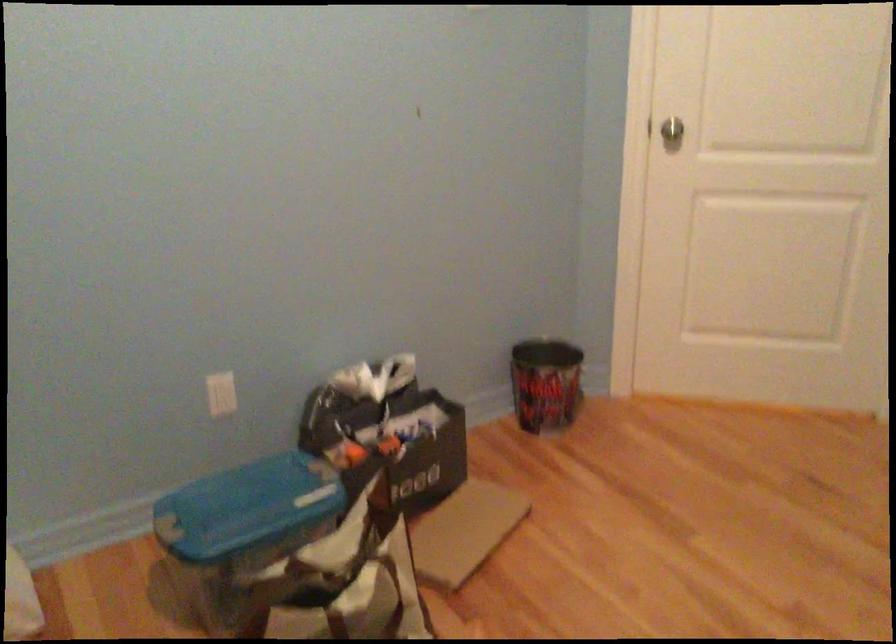
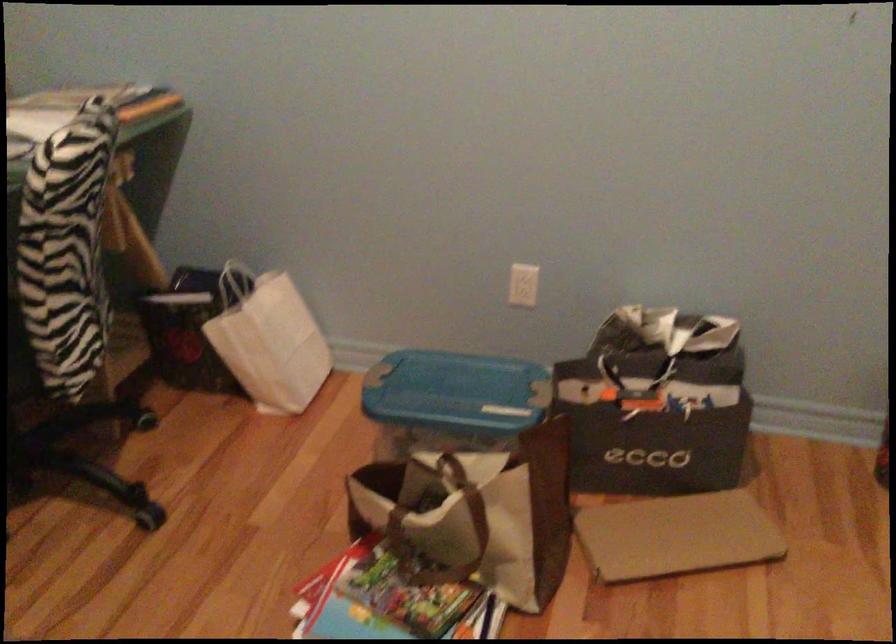
Find the pixel in the second image that matches (255,507) in the first image.

(455, 393)